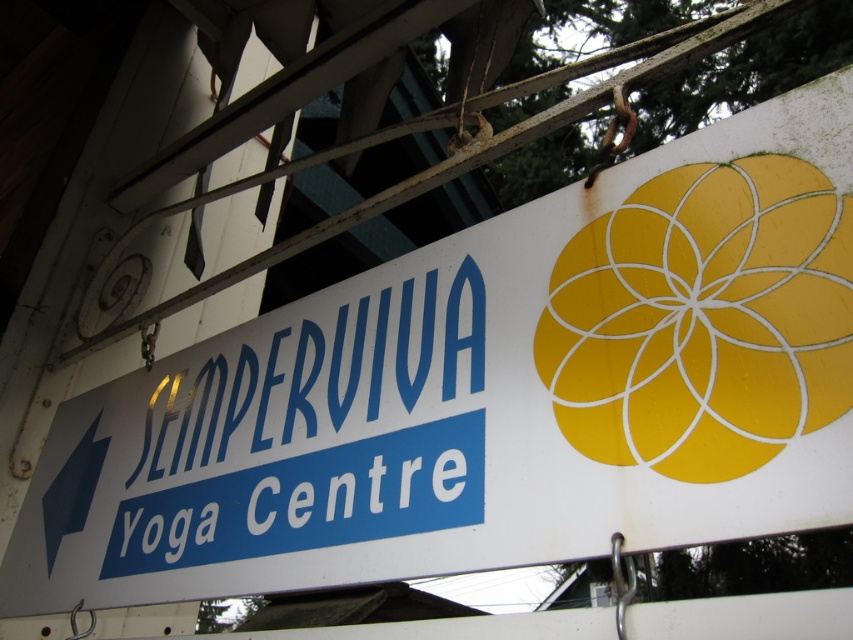
Question: Observing the image, what is the correct spatial positioning of yellow matte flower at upper right in reference to blue metallic sign at center?

Choices:
 (A) left
 (B) right

Answer: (B)

Question: Which of the following is the closest to the observer?

Choices:
 (A) (642, 273)
 (B) (241, 368)

Answer: (A)

Question: Does yellow matte flower at upper right have a lesser width compared to blue metallic sign at center?

Choices:
 (A) yes
 (B) no

Answer: (A)

Question: Does yellow matte flower at upper right have a greater width compared to blue metallic sign at center?

Choices:
 (A) no
 (B) yes

Answer: (A)

Question: Which of the following is the closest to the observer?

Choices:
 (A) blue metallic sign at center
 (B) yellow matte flower at upper right

Answer: (B)